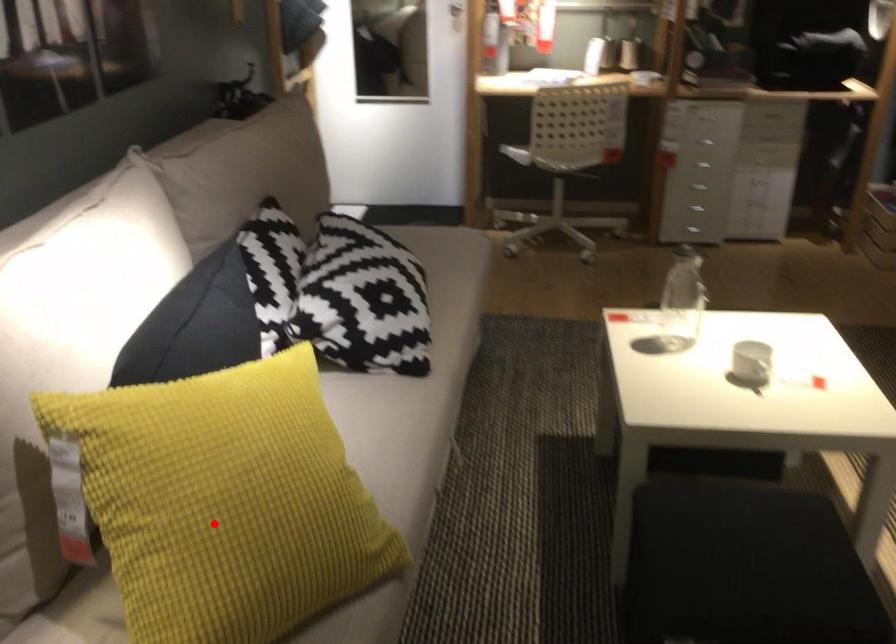
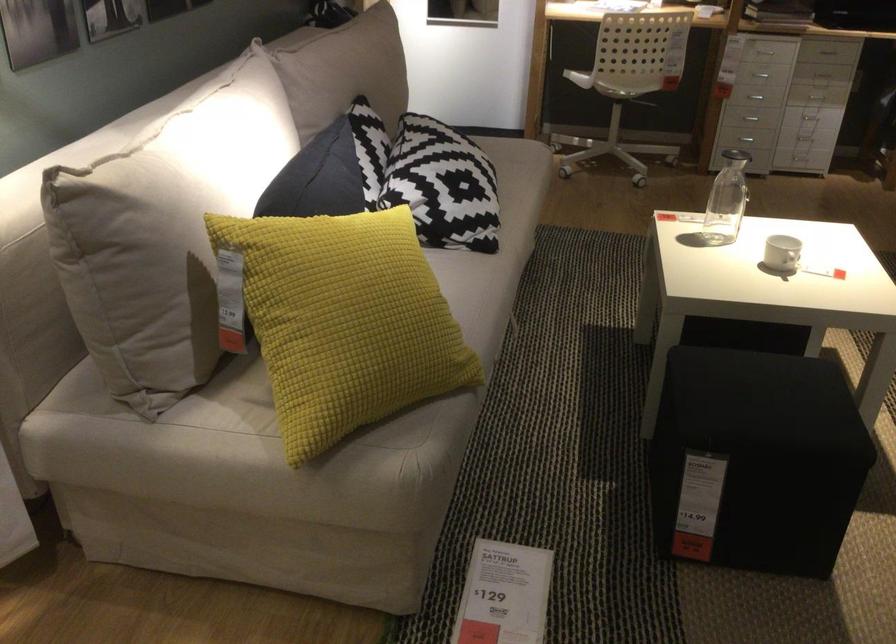
Question: I am providing you with two images of the same scene from different viewpoints. Image1 has a red point marked. In image2, the corresponding 3D location appears at what relative position? Reply with the corresponding letter.

Choices:
 (A) Closer
 (B) Farther

Answer: (B)